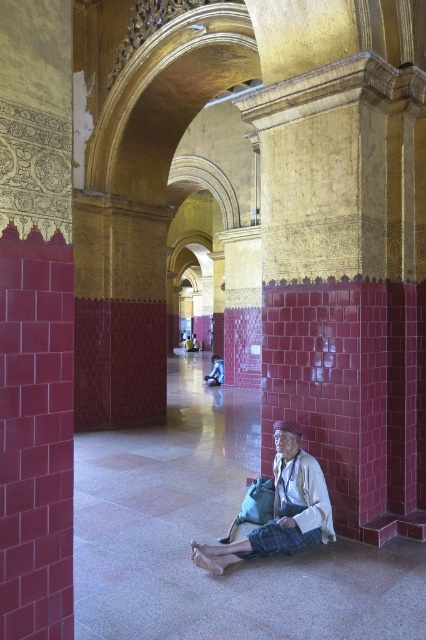
Question: Does white fabric cloth at center lie behind blue fabric bag at center?

Choices:
 (A) no
 (B) yes

Answer: (A)

Question: Observing the image, what is the correct spatial positioning of white fabric cloth at center in reference to blue fabric bag at center?

Choices:
 (A) left
 (B) right

Answer: (B)

Question: Does white fabric cloth at center appear over blue fabric bag at center?

Choices:
 (A) yes
 (B) no

Answer: (B)